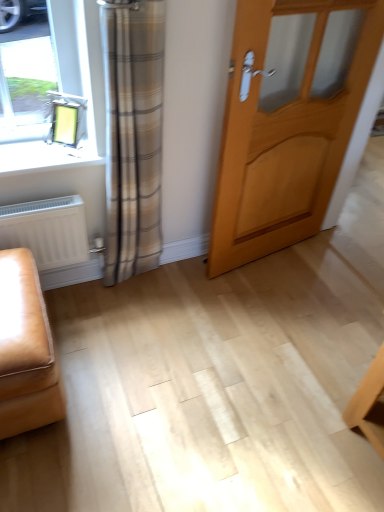
This screenshot has width=384, height=512. What are the coordinates of `vacant space to the right of leather ottoman at lower left` in the screenshot? It's located at (133, 384).